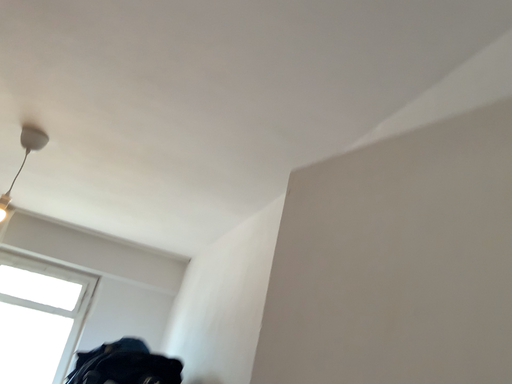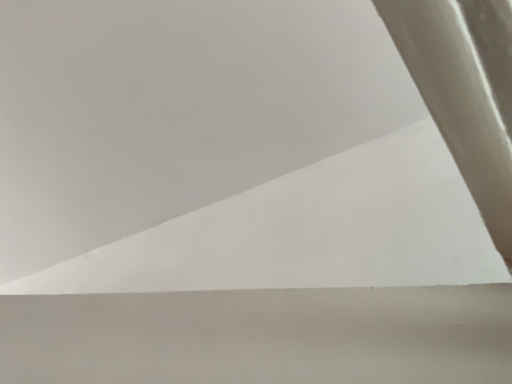
Question: How did the camera likely rotate when shooting the video?

Choices:
 (A) rotated upward
 (B) rotated downward

Answer: (A)